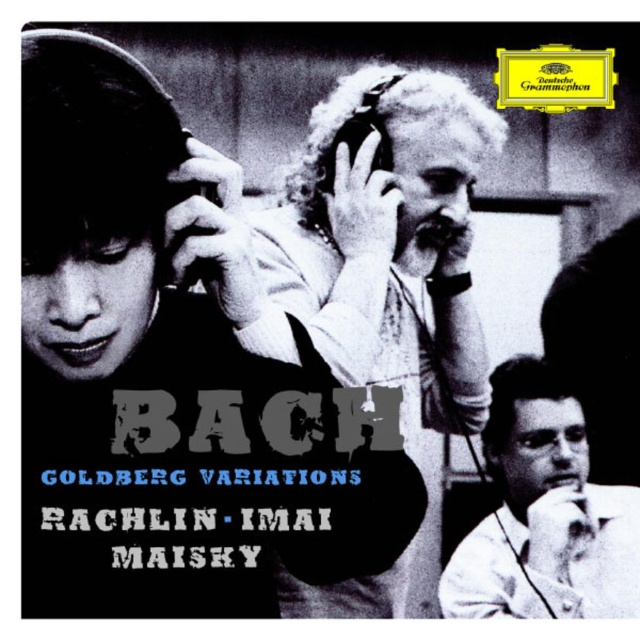
Based on the photo, you are a photographer trying to focus on the subject in the image. Which object, the white curly hair at upper center or the white smooth shirt at lower right, is closer to the camera?

The white curly hair at upper center is closer to the camera because it is positioned over the white smooth shirt at lower right.

You are a photographer in the studio. You notice the white curly hair at upper center and the white smooth shirt at lower right. Which object takes up more space in the photo?

The white curly hair at upper center takes up more space in the photo because it has a larger size compared to the white smooth shirt at lower right.